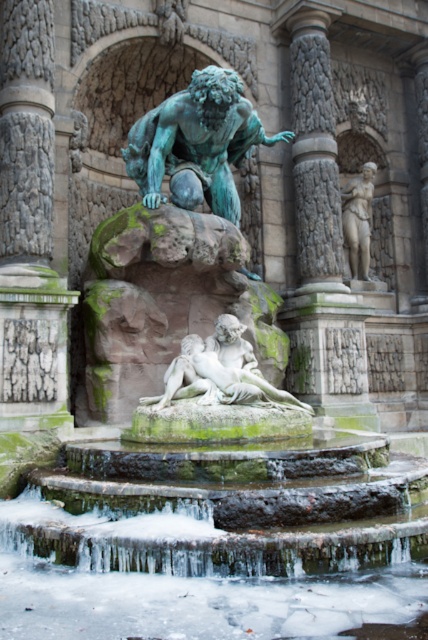
Based on the photo, you are standing in front of the fountain sculpture and want to touch both points on it. Which point should you reach for first, the one at point (171, 125) or the one at (243, 369)?

You should reach for point (171, 125) first because it is closer to you than point (243, 369).

You are standing at the entrance of the architectural structure where the classical fountain sculpture is located. You want to take a photo of the white marble statue at center from a position that ensures it is centered in your camera frame. According to the coordinates provided, where should you position yourself relative to the statue?

The white marble statue at center is located at point [219,371], so you should position yourself directly in front of it along the central axis to ensure it is centered in your camera frame.

You are an art conservator examining the fountain. You notice that the green patina bronze statue at center and the white marble statue at center are both central to the composition. Which one is positioned to the right side of the other?

The green patina bronze statue at center is positioned to the right of the white marble statue at center.